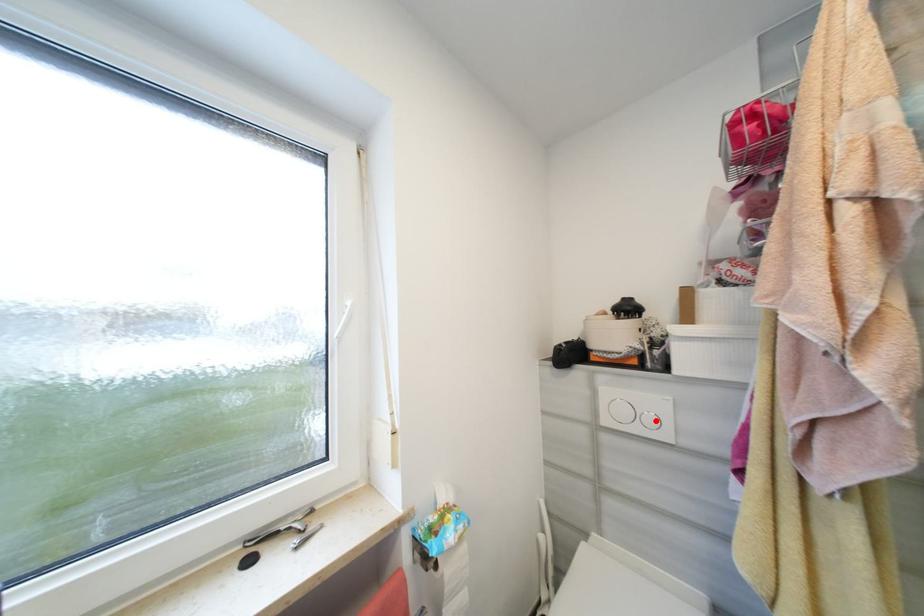
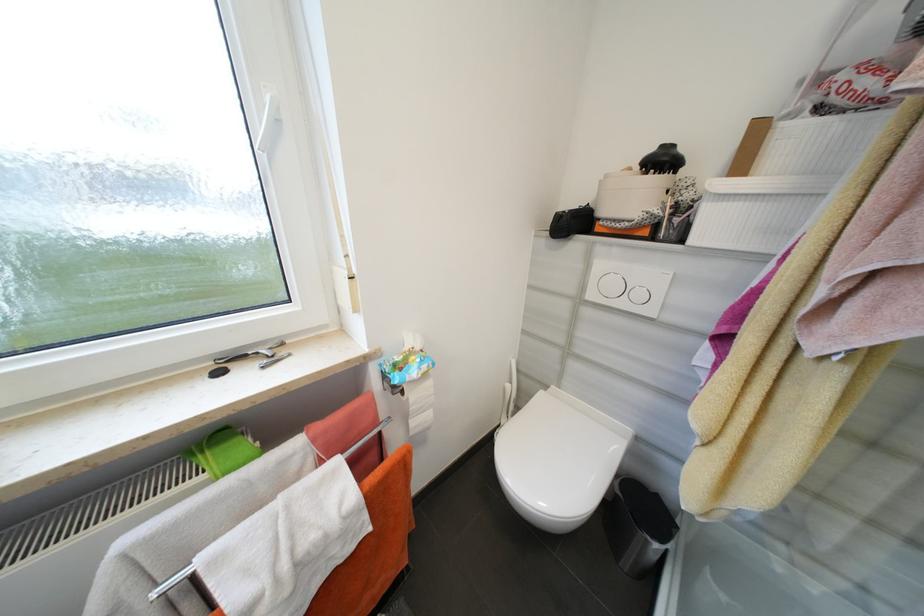
Question: I am providing you with two images of the same scene from different viewpoints. In image1, a red point is highlighted. Considering the same 3D point in image2, which of the following is correct?

Choices:
 (A) It is closer
 (B) It is farther

Answer: (A)